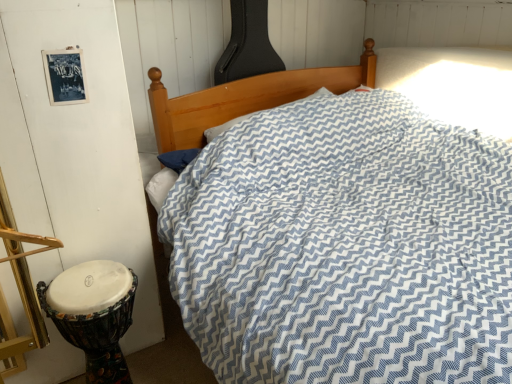
What do you see at coordinates (93, 314) in the screenshot?
I see `white textured drum at lower left` at bounding box center [93, 314].

Locate an element on the screen. white textured drum at lower left is located at coordinates 93,314.

Find the location of `white textured drum at lower left`. white textured drum at lower left is located at coordinates (93, 314).